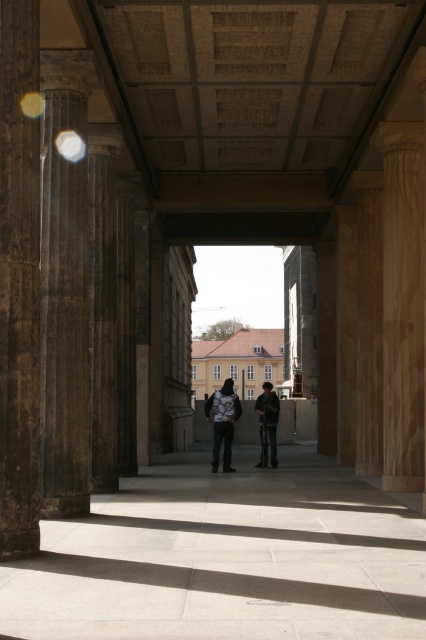
You are walking through the grand corridor and want to place your dark gray backpack at center on the floor next to the dark brown polished column at left. Is the column to the left or right of the backpack?

The dark brown polished column at left is positioned on the left side of the dark gray backpack at center, so the column is to the left of the backpack.

You are walking along the corridor and want to place a small plant pot between the dark brown polished column at left and the dark gray backpack at center. Can you do this without moving the backpack?

The dark brown polished column at left is closer to the viewer than the dark gray backpack at center, so placing the plant pot between them would require positioning it in the space between the column and the backpack along the corridor. Since the backpack is at the center and the column is closer, there is likely enough space to place the plant pot without moving the backpack.

You are standing at the entrance of the corridor and want to take a photo of the dark brown stone pillar at left. If your camera has a maximum focus range of 6 meters, will it be able to capture the pillar clearly?

The dark brown stone pillar at left is 6.49 meters away from the camera, which exceeds the maximum focus range of 6 meters. Therefore, the camera might not be able to capture the pillar clearly.